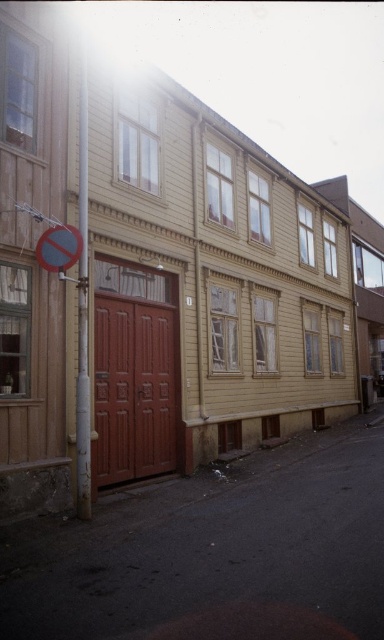
Question: Based on their relative distances, which object is farther from the yellow plastic traffic sign at upper left?

Choices:
 (A) metallic silver pole at center
 (B) brown wooden alley at lower left

Answer: (B)

Question: In this image, where is brown wooden alley at lower left located relative to metallic silver pole at center?

Choices:
 (A) left
 (B) right

Answer: (B)

Question: Which is farther from the brown wooden alley at lower left?

Choices:
 (A) metallic silver pole at center
 (B) yellow plastic traffic sign at upper left

Answer: (B)

Question: Which of the following is the closest to the observer?

Choices:
 (A) yellow plastic traffic sign at upper left
 (B) brown wooden alley at lower left

Answer: (B)

Question: Does metallic silver pole at center lie in front of yellow plastic traffic sign at upper left?

Choices:
 (A) no
 (B) yes

Answer: (B)

Question: Can you confirm if brown wooden alley at lower left is positioned to the right of metallic silver pole at center?

Choices:
 (A) yes
 (B) no

Answer: (A)